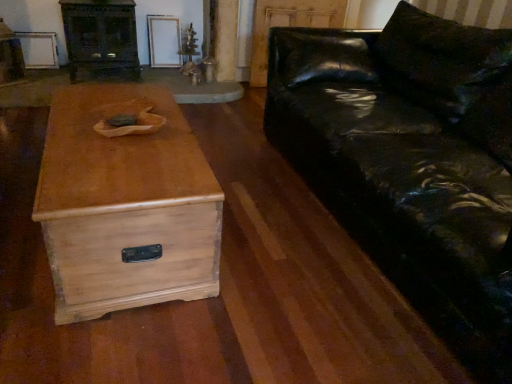
At what (x,y) coordinates should I click in order to perform the action: click on vacant space to the right of light wood chest at center. Please return your answer as a coordinate pair (x, y). The width and height of the screenshot is (512, 384). Looking at the image, I should click on (287, 258).